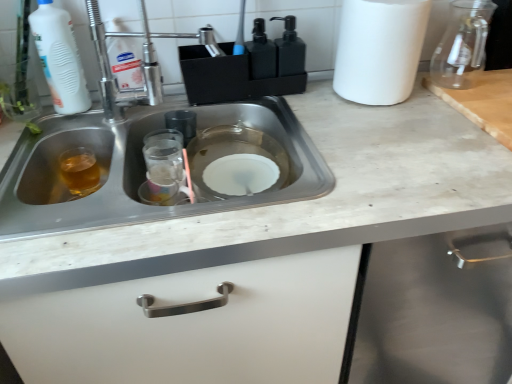
Question: Is transparent glass jar at upper right wider or thinner than black matte soap dispenser at upper center?

Choices:
 (A) thin
 (B) wide

Answer: (B)

Question: From a real-world perspective, is transparent glass jar at upper right above or below black matte soap dispenser at upper center?

Choices:
 (A) below
 (B) above

Answer: (B)

Question: Based on their relative distances, which object is nearer to the transparent glass jar at upper right?

Choices:
 (A) black matte soap dispenser at upper center
 (B) translucent amber liquid at sink left
 (C) white matte bottle at upper left
 (D) stainless steel sink at center
 (E) white matte paper towel at upper right

Answer: (E)

Question: Estimate the real-world distances between objects in this image. Which object is farther from the translucent amber liquid at sink left?

Choices:
 (A) white matte bottle at upper left
 (B) black matte soap dispenser at upper center
 (C) black matte soap dispenser at upper center
 (D) stainless steel sink at center
 (E) white matte paper towel at upper right

Answer: (E)